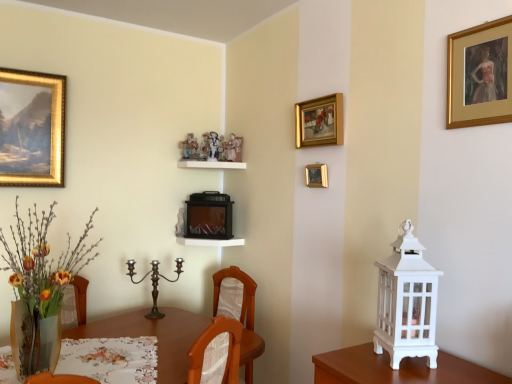
How much space does polished bronze candle holder at center, marked as the second candle holder in a right-to-left arrangement, occupy horizontally?

polished bronze candle holder at center, marked as the second candle holder in a right-to-left arrangement, is 4.71 inches in width.

Measure the distance between point (304, 118) and camera.

Point (304, 118) is 7.25 feet away from camera.

The height and width of the screenshot is (384, 512). What do you see at coordinates (211, 164) in the screenshot?
I see `white glossy shelf at upper center, marked as the 2th shelf in a bottom-to-top arrangement` at bounding box center [211, 164].

Measure the distance between white painted wood lantern at right, which is the 1th candle holder from front to back, and camera.

1.33 meters.

The image size is (512, 384). What are the coordinates of `gold/golden frame at upper right, acting as the third picture frame starting from the back` in the screenshot? It's located at (480, 75).

Is white painted wood lantern at right, which is the 1th candle holder from front to back, wider than gold metallic picture frame at upper center, which is counted as the first picture frame, starting from the left?

Yes, white painted wood lantern at right, which is the 1th candle holder from front to back, is wider than gold metallic picture frame at upper center, which is counted as the first picture frame, starting from the left.

From the picture: From a real-world perspective, who is located higher, white painted wood lantern at right, which is counted as the first candle holder, starting from the right, or gold metallic picture frame at upper center, which is counted as the first picture frame, starting from the left?

gold metallic picture frame at upper center, which is counted as the first picture frame, starting from the left, from a real-world perspective.

Is point (403, 340) less distant than point (317, 172)?

Yes, it is in front of point (317, 172).

Does white painted wood lantern at right, the second candle holder from the back, have a larger size compared to gold metallic picture frame at upper center, the 3th picture frame when ordered from front to back?

Yes, white painted wood lantern at right, the second candle holder from the back, is bigger than gold metallic picture frame at upper center, the 3th picture frame when ordered from front to back.

Relative to gold metallic picture frame at upper center, which is counted as the 3th picture frame, starting from the right, is white glossy shelf at center, arranged as the first shelf when ordered from the bottom, in front or behind?

white glossy shelf at center, arranged as the first shelf when ordered from the bottom, is positioned farther from the viewer than gold metallic picture frame at upper center, which is counted as the 3th picture frame, starting from the right.

Is white glossy shelf at center, arranged as the first shelf when ordered from the bottom, spatially inside gold metallic picture frame at upper center, which is counted as the first picture frame, starting from the left, or outside of it?

Answer: white glossy shelf at center, arranged as the first shelf when ordered from the bottom, exists outside the volume of gold metallic picture frame at upper center, which is counted as the first picture frame, starting from the left.

Which is farther, (229, 244) or (314, 179)?

The point (229, 244) is farther from the camera.

Is gold-framed painting at upper center, which is the second picture frame from back to front, positioned with its back to gold/golden frame at upper right, which is the 1th picture frame from front to back?

No, gold-framed painting at upper center, which is the second picture frame from back to front, is not facing the opposite direction of gold/golden frame at upper right, which is the 1th picture frame from front to back.

From a real-world perspective, is gold-framed painting at upper center, placed as the 2th picture frame when sorted from front to back, positioned above or below gold/golden frame at upper right, the 1th picture frame when ordered from right to left?

In terms of real-world spatial position, gold-framed painting at upper center, placed as the 2th picture frame when sorted from front to back, is below gold/golden frame at upper right, the 1th picture frame when ordered from right to left.

Based on their positions, is gold-framed painting at upper center, placed as the 2th picture frame when sorted from front to back, located to the left or right of gold/golden frame at upper right, acting as the third picture frame starting from the back?

From the image, it's evident that gold-framed painting at upper center, placed as the 2th picture frame when sorted from front to back, is to the left of gold/golden frame at upper right, acting as the third picture frame starting from the back.

Is gold-framed painting at upper center, placed as the 2th picture frame when sorted from front to back, far away from gold/golden frame at upper right, the 1th picture frame when ordered from right to left?

That's not correct — gold-framed painting at upper center, placed as the 2th picture frame when sorted from front to back, is a little close to gold/golden frame at upper right, the 1th picture frame when ordered from right to left.

Which object is closer to the camera, floral lace tablecloth at lower left or brown wooden table at center?

brown wooden table at center is closer to the camera.

The height and width of the screenshot is (384, 512). Find the location of `tablecloth below the brown wooden table at center (from the image's perspective)`. tablecloth below the brown wooden table at center (from the image's perspective) is located at coordinates (110, 359).

Is floral lace tablecloth at lower left aimed at brown wooden table at center?

No, floral lace tablecloth at lower left is not turned towards brown wooden table at center.

From the picture: Would you say floral lace tablecloth at lower left is a long distance from brown wooden table at center?

No.

Visually, is translucent glass vase at lower left positioned to the left or to the right of white painted wood lantern at right, which is counted as the first candle holder, starting from the right?

Clearly, translucent glass vase at lower left is on the left of white painted wood lantern at right, which is counted as the first candle holder, starting from the right, in the image.

Is point (48, 358) less distant than point (380, 280)?

No, it is not.

Looking at this image, considering the sizes of translucent glass vase at lower left and white painted wood lantern at right, which is the 1th candle holder from front to back, in the image, is translucent glass vase at lower left taller or shorter than white painted wood lantern at right, which is the 1th candle holder from front to back,?

In the image, translucent glass vase at lower left appears to be taller than white painted wood lantern at right, which is the 1th candle holder from front to back.

Is translucent glass vase at lower left at the back of gold-framed painting at upper center, the second picture frame positioned from the left?

No.

Would you say gold-framed painting at upper center, placed as the 2th picture frame when sorted from front to back, is to the left or to the right of translucent glass vase at lower left in the picture?

gold-framed painting at upper center, placed as the 2th picture frame when sorted from front to back, is to the right of translucent glass vase at lower left.

Looking at this image, which of these two, gold-framed painting at upper center, placed as the 2th picture frame when sorted from front to back, or translucent glass vase at lower left, stands shorter?

gold-framed painting at upper center, placed as the 2th picture frame when sorted from front to back, is shorter.

Can we say gold-framed painting at upper center, the second picture frame positioned from the left, lies outside translucent glass vase at lower left?

Yes, gold-framed painting at upper center, the second picture frame positioned from the left, is located beyond the bounds of translucent glass vase at lower left.

Looking at the image, does white glossy shelf at upper center, marked as the 2th shelf in a bottom-to-top arrangement, seem bigger or smaller compared to polished bronze candle holder at center, marked as the second candle holder in a right-to-left arrangement?

In the image, white glossy shelf at upper center, marked as the 2th shelf in a bottom-to-top arrangement, appears to be smaller than polished bronze candle holder at center, marked as the second candle holder in a right-to-left arrangement.

How different are the orientations of white glossy shelf at upper center, which appears as the first shelf when viewed from the top, and polished bronze candle holder at center, which appears as the 1th candle holder when viewed from the left, in degrees?

There is a 80.4-degree angle between the facing directions of white glossy shelf at upper center, which appears as the first shelf when viewed from the top, and polished bronze candle holder at center, which appears as the 1th candle holder when viewed from the left.

Which point is more forward, (224,166) or (153,261)?

The point (224,166) is in front.

Is white glossy shelf at upper center, marked as the 2th shelf in a bottom-to-top arrangement, oriented towards polished bronze candle holder at center, arranged as the 2th candle holder when viewed from the front?

No, white glossy shelf at upper center, marked as the 2th shelf in a bottom-to-top arrangement, is not turned towards polished bronze candle holder at center, arranged as the 2th candle holder when viewed from the front.

Starting from the white painted wood lantern at right, which is counted as the first candle holder, starting from the right, which picture frame is the 2nd one to the left? Please provide its 2D coordinates.

[(316, 175)]

Find the location of a particular element. Image resolution: width=512 pixels, height=384 pixels. the 1st picture frame to the right when counting from the white glossy shelf at center, arranged as the first shelf when ordered from the bottom is located at coordinates (316, 175).

Estimate the real-world distances between objects in this image. Which object is further from gold metallic picture frame at upper center, arranged as the first picture frame when viewed from the back, gold-framed painting at upper center, which is the second picture frame from back to front, or floral lace tablecloth at lower left?

floral lace tablecloth at lower left lies further to gold metallic picture frame at upper center, arranged as the first picture frame when viewed from the back, than the other object.

Looking at the image, which one is located closer to white painted wood lantern at right, which is the 1th candle holder from front to back, floral lace tablecloth at lower left or gold metallic picture frame at upper center, which is counted as the 3th picture frame, starting from the right?

Based on the image, gold metallic picture frame at upper center, which is counted as the 3th picture frame, starting from the right, appears to be nearer to white painted wood lantern at right, which is the 1th candle holder from front to back.

From the picture: Considering their positions, is gold/golden frame at upper right, the 1th picture frame when ordered from right to left, positioned further to white glossy shelf at upper center, marked as the 2th shelf in a bottom-to-top arrangement, than white painted wood lantern at right, which is counted as the second candle holder, starting from the left?

Among the two, white painted wood lantern at right, which is counted as the second candle holder, starting from the left, is located further to white glossy shelf at upper center, marked as the 2th shelf in a bottom-to-top arrangement.

Based on their spatial positions, is floral lace tablecloth at lower left or white glossy shelf at center, arranged as the first shelf when ordered from the bottom, closer to gold metallic picture frame at upper center, the 3th picture frame when ordered from front to back?

white glossy shelf at center, arranged as the first shelf when ordered from the bottom, lies closer to gold metallic picture frame at upper center, the 3th picture frame when ordered from front to back, than the other object.

Consider the image. Considering their positions, is gold-framed painting at upper center, which is the second picture frame from back to front, positioned further to gold/golden frame at upper right, which is the 1th picture frame from front to back, than white glossy shelf at center, the second shelf viewed from the top?

Among the two, white glossy shelf at center, the second shelf viewed from the top, is located further to gold/golden frame at upper right, which is the 1th picture frame from front to back.

From the image, which object appears to be farther from polished bronze candle holder at center, positioned as the 1th candle holder in back-to-front order, gold-framed painting at upper center, placed as the 2th picture frame when sorted from front to back, or gold/golden frame at upper right, the 1th picture frame when ordered from right to left?

gold/golden frame at upper right, the 1th picture frame when ordered from right to left, lies further to polished bronze candle holder at center, positioned as the 1th candle holder in back-to-front order, than the other object.

When comparing their distances from white glossy shelf at center, the second shelf viewed from the top, does white glossy shelf at upper center, marked as the 2th shelf in a bottom-to-top arrangement, or gold-framed painting at upper center, which is the second picture frame from back to front, seem further?

gold-framed painting at upper center, which is the second picture frame from back to front, is further to white glossy shelf at center, the second shelf viewed from the top.

Consider the image. Estimate the real-world distances between objects in this image. Which object is closer to white painted wood lantern at right, which is the 1th candle holder from front to back, gold/golden frame at upper right, the 1th picture frame when ordered from right to left, or gold-framed painting at upper center, placed as the 2th picture frame when sorted from front to back?

gold/golden frame at upper right, the 1th picture frame when ordered from right to left, is positioned closer to the anchor white painted wood lantern at right, which is the 1th candle holder from front to back.

At what (x,y) coordinates should I click in order to perform the action: click on candle holder positioned between white painted wood lantern at right, which is counted as the first candle holder, starting from the right, and white glossy shelf at upper center, marked as the 2th shelf in a bottom-to-top arrangement, from near to far. Please return your answer as a coordinate pair (x, y). Looking at the image, I should click on (154, 283).

Where is `candle holder between floral lace tablecloth at lower left and white glossy shelf at center, arranged as the first shelf when ordered from the bottom, from front to back`? The image size is (512, 384). candle holder between floral lace tablecloth at lower left and white glossy shelf at center, arranged as the first shelf when ordered from the bottom, from front to back is located at coordinates (154, 283).

Find the location of `table located between translucent glass vase at lower left and gold metallic picture frame at upper center, which is counted as the first picture frame, starting from the left, in the left-right direction`. table located between translucent glass vase at lower left and gold metallic picture frame at upper center, which is counted as the first picture frame, starting from the left, in the left-right direction is located at coordinates (153, 335).

Locate an element on the screen. This screenshot has height=384, width=512. shelf between floral lace tablecloth at lower left and white glossy shelf at center, the second shelf viewed from the top, from front to back is located at coordinates (211, 164).